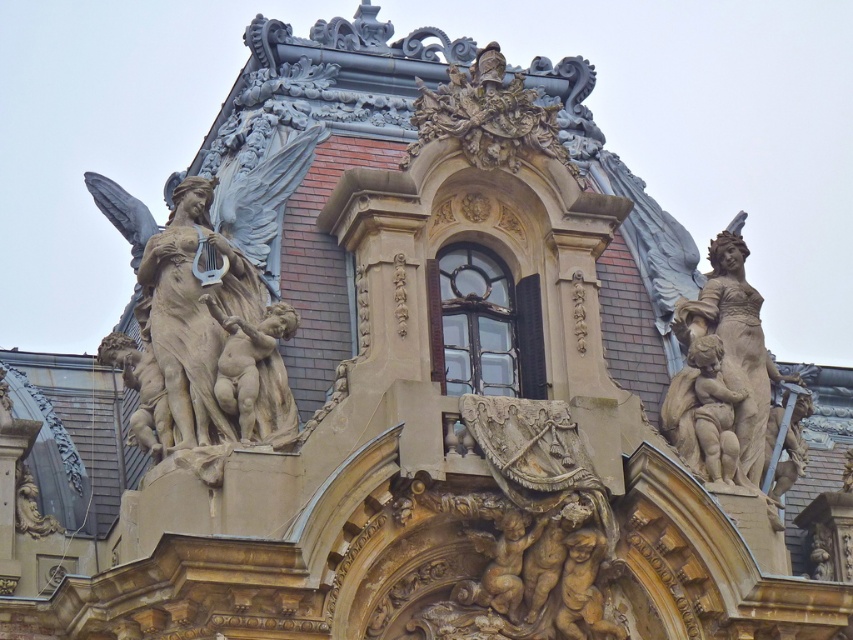
Can you confirm if polished bronze statue at upper left is positioned above carved stone statue at right?

Yes, polished bronze statue at upper left is above carved stone statue at right.

Does polished bronze statue at upper left have a greater width compared to carved stone statue at right?

Indeed, polished bronze statue at upper left has a greater width compared to carved stone statue at right.

What do you see at coordinates (210, 333) in the screenshot? I see `polished bronze statue at upper left` at bounding box center [210, 333].

Find the location of a particular element. The image size is (853, 640). polished bronze statue at upper left is located at coordinates (210, 333).